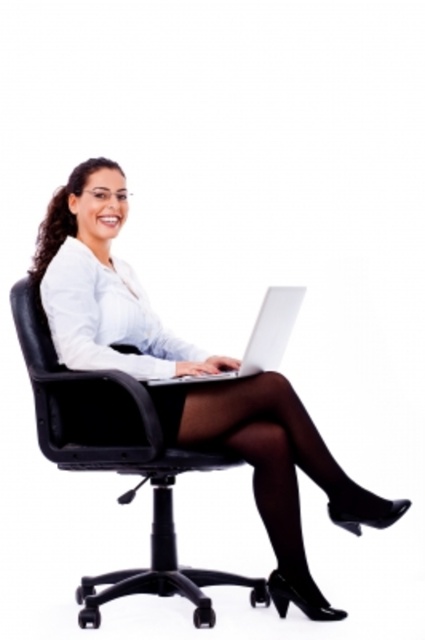
In the scene shown: Is matte black laptop at center taller than silver metallic laptop at center?

Yes.

Is point (308, 420) behind point (261, 323)?

That is True.

Locate an element on the screen. Image resolution: width=425 pixels, height=640 pixels. matte black laptop at center is located at coordinates (274, 468).

Is point (291, 449) positioned behind point (81, 582)?

No.

Locate an element on the screen. Image resolution: width=425 pixels, height=640 pixels. matte black laptop at center is located at coordinates (274, 468).

Who is positioned more to the left, black leather swivel chair at center or silver metallic laptop at center?

Positioned to the left is black leather swivel chair at center.

Between black leather swivel chair at center and silver metallic laptop at center, which one has more height?

Standing taller between the two is black leather swivel chair at center.

The height and width of the screenshot is (640, 425). In order to click on black leather swivel chair at center in this screenshot , I will do `click(118, 465)`.